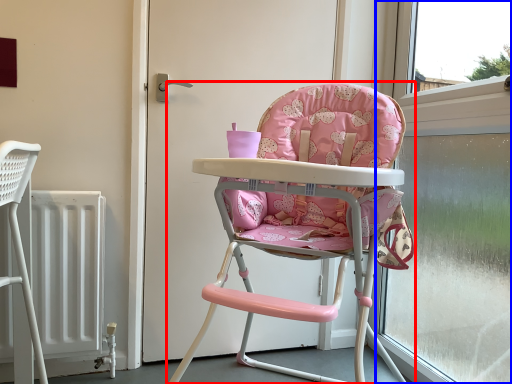
Question: Which point is further to the camera, chair (highlighted by a red box) or window frame (highlighted by a blue box)?

Choices:
 (A) chair
 (B) window frame

Answer: (B)